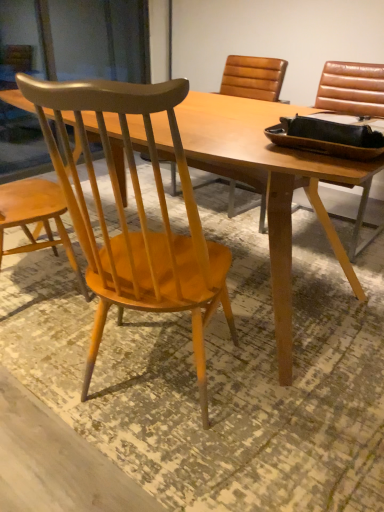
You are a GUI agent. You are given a task and a screenshot of the screen. Output one action in this format:
    pyautogui.click(x=<x>, y=<y>)
    Task: Click on the vacant region to the right of light brown wood chair at left
    The width and height of the screenshot is (384, 512).
    Given the screenshot: What is the action you would take?
    pyautogui.click(x=288, y=395)